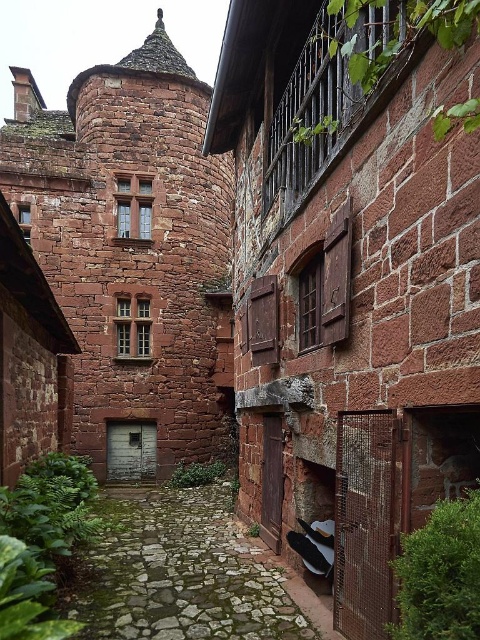
From the picture: Is rustic stone castle at center to the right of green mossy stone path at lower center from the viewer's perspective?

In fact, rustic stone castle at center is to the left of green mossy stone path at lower center.

Does rustic stone castle at center appear over green mossy stone path at lower center?

Yes.

The height and width of the screenshot is (640, 480). What are the coordinates of `rustic stone castle at center` in the screenshot? It's located at (132, 253).

Locate an element on the screen. This screenshot has height=640, width=480. rustic stone castle at center is located at coordinates (132, 253).